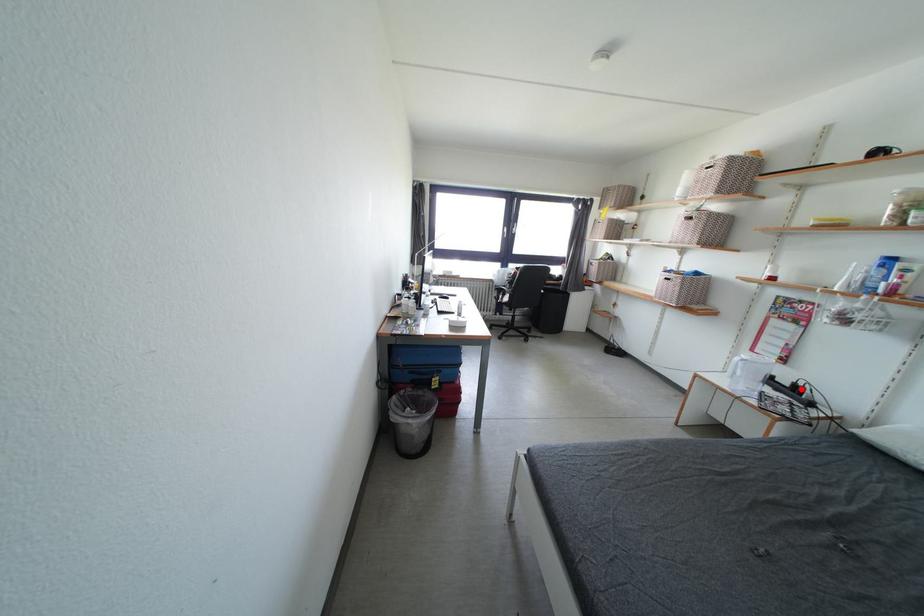
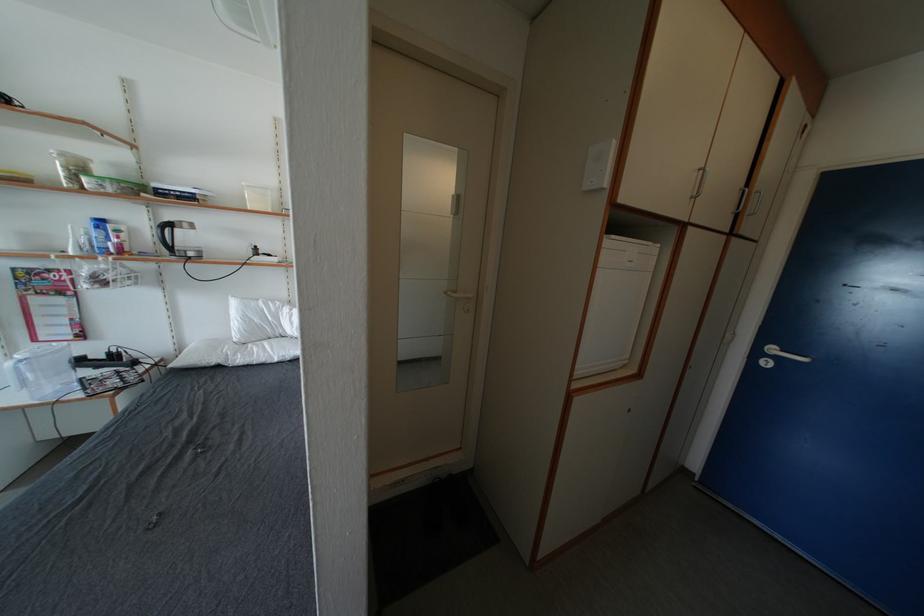
The point at the highlighted location is marked in the first image. Where is the corresponding point in the second image?

(116, 359)